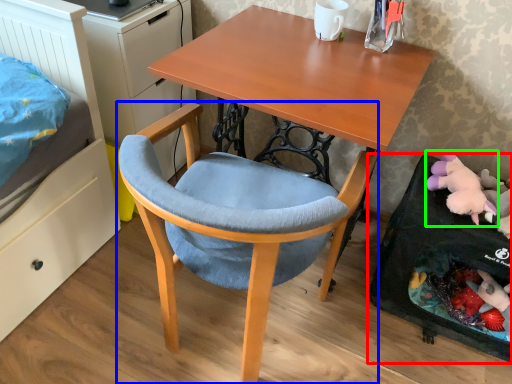
Question: Estimate the real-world distances between objects in this image. Which object is farther from desktop (highlighted by a red box), chair (highlighted by a blue box) or toy (highlighted by a green box)?

Choices:
 (A) chair
 (B) toy

Answer: (A)